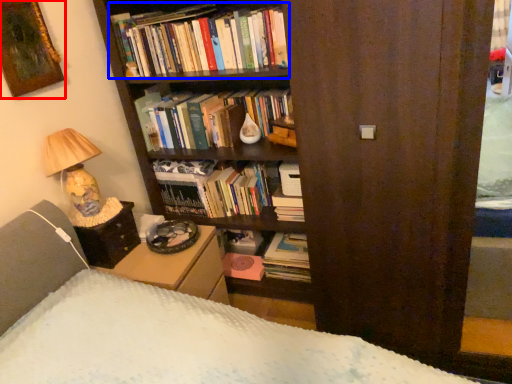
Question: Among these objects, which one is nearest to the camera, picture frame (highlighted by a red box) or book (highlighted by a blue box)?

Choices:
 (A) picture frame
 (B) book

Answer: (A)